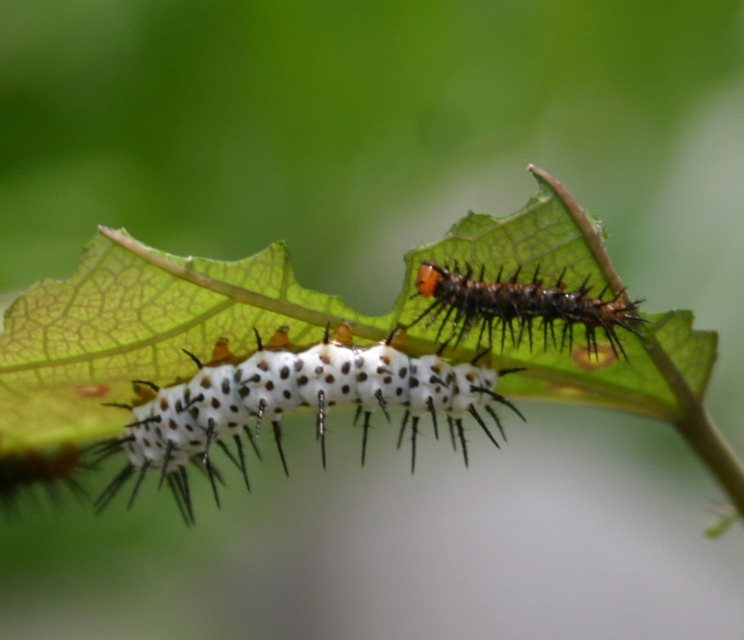
In the scene shown: Based on the coordinates provided, where is the white spiny caterpillar at center located in the image?

The white spiny caterpillar at center is located at the 2D coordinates point [289,404].

You are an entomologist observing the caterpillar and the leaf. You notice two points marked on your screen at coordinates point (440, 394) and point (519, 340). Which point is closer to the viewer?

Point (519, 340) is closer to the viewer because point (440, 394) is behind it.